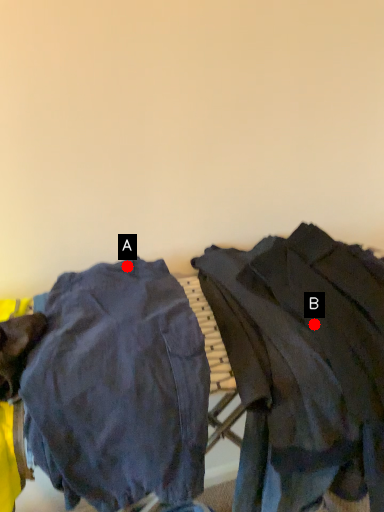
Question: Two points are circled on the image, labeled by A and B beside each circle. Which point is farther to the camera?

Choices:
 (A) A is further
 (B) B is further

Answer: (A)